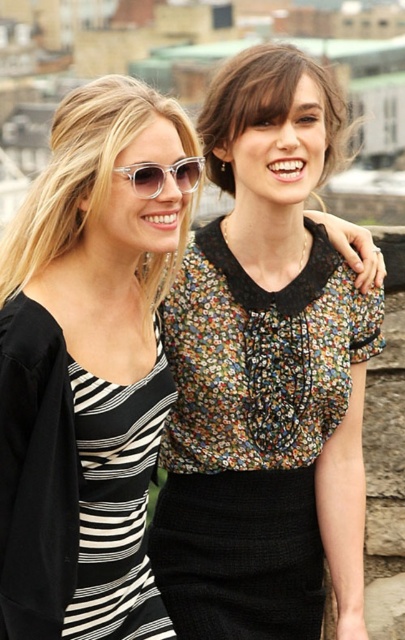
Question: Which object is the closest to the floral fabric blouse at upper center?

Choices:
 (A) floral fabric blouse at center
 (B) black and white striped dress at center

Answer: (A)

Question: Estimate the real-world distances between objects in this image. Which object is farther from the clear acetate sunglasses at upper center?

Choices:
 (A) floral fabric blouse at center
 (B) floral fabric blouse at upper center
 (C) black and white striped dress at center

Answer: (C)

Question: Is floral fabric blouse at center above black and white striped dress at center?

Choices:
 (A) no
 (B) yes

Answer: (B)

Question: Can you confirm if black and white striped dress at center is positioned to the right of floral fabric blouse at upper center?

Choices:
 (A) yes
 (B) no

Answer: (B)

Question: Is floral fabric blouse at center closer to camera compared to floral fabric blouse at upper center?

Choices:
 (A) no
 (B) yes

Answer: (B)

Question: Which point is farther from the camera taking this photo?

Choices:
 (A) (178, 166)
 (B) (93, 525)
 (C) (219, 120)
 (D) (210, 554)

Answer: (C)